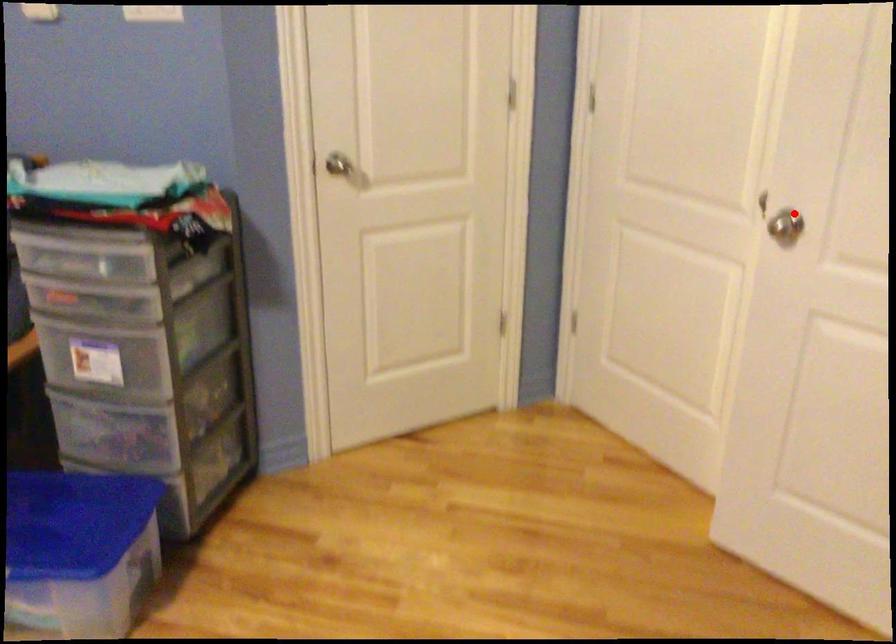
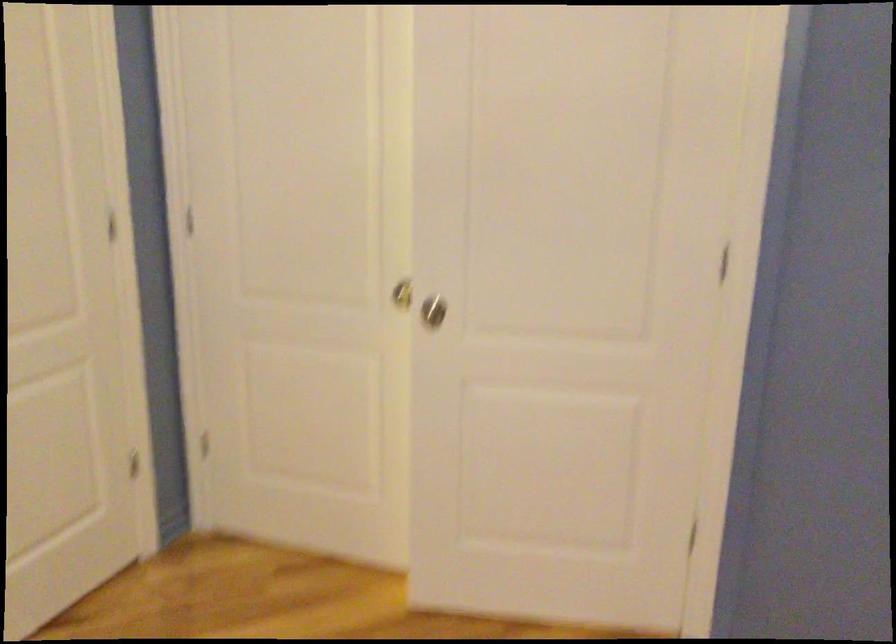
Question: I am providing you with two images of the same scene from different viewpoints. Image1 has a red point marked. In image2, the corresponding 3D location appears at what relative position? Reply with the corresponding letter.

Choices:
 (A) Closer
 (B) Farther

Answer: (B)